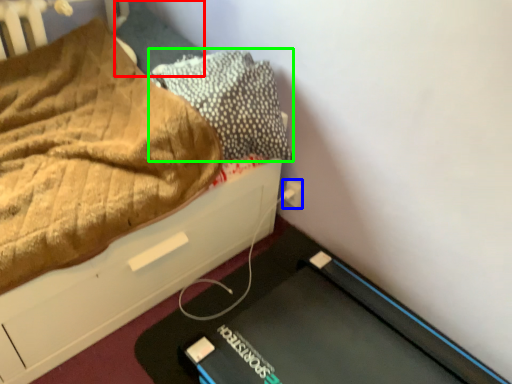
Question: Which object is positioned closest to pillow (highlighted by a red box)? Select from electric outlet (highlighted by a blue box) and pillow (highlighted by a green box).

Choices:
 (A) electric outlet
 (B) pillow

Answer: (B)